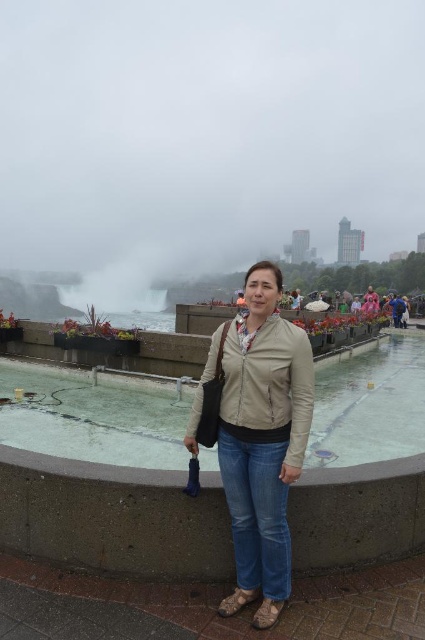
You are a photographer trying to capture a photo of the beige leather jacket at center and the clear glass water at center. Based on their positions, which object should you focus on first to ensure both are in the frame?

The beige leather jacket at center should be focused on first since the clear glass water at center is on its right side, so adjusting the frame to include the jacket first ensures the water will also be captured to its right.

You are a photographer trying to capture the beige leather jacket at center and the clear glass water at center in a single shot. Which object should you focus on first to ensure both are in focus?

You should focus on the beige leather jacket at center first because it is closer to you than the clear glass water at center, which is further away. By focusing on the closer object, the background object will also be in focus due to the depth of field.

You are standing at the observation deck looking at the Niagara Falls scene. There are two points marked in the image. The first point is at coordinates point (329, 449) and the second is at point (248, 348). Which point is closer to your position?

Point (329, 449) is further to the camera than point (248, 348), so the closer point to your position is point (248, 348).